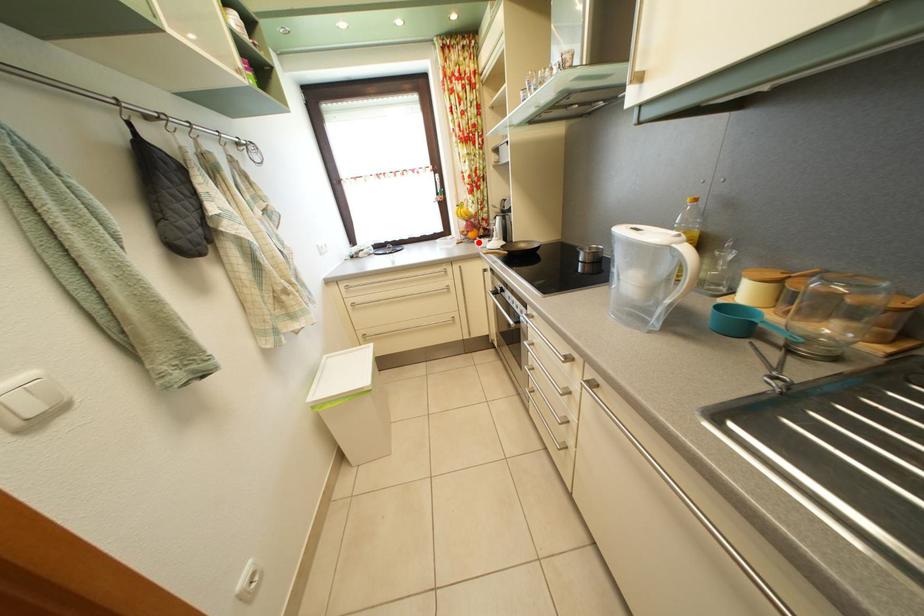
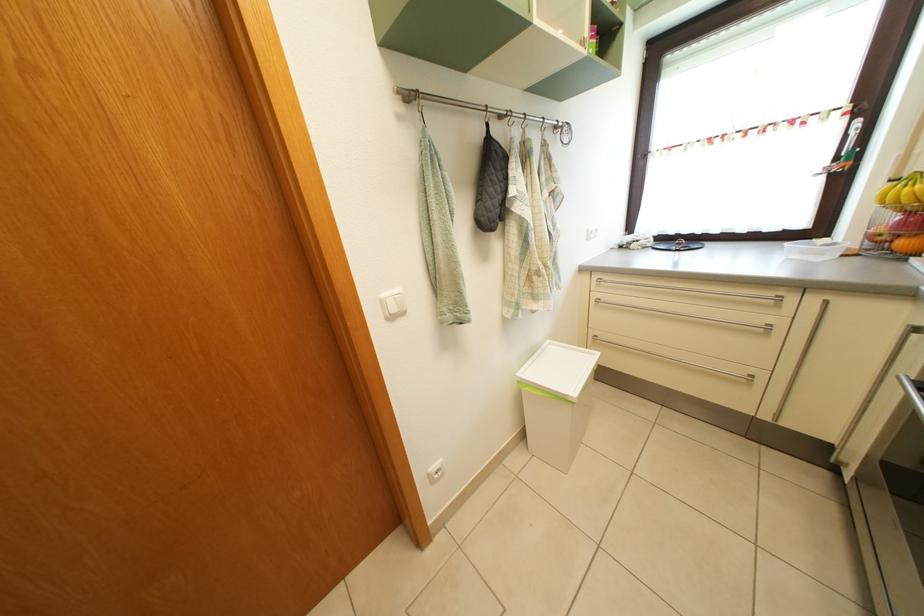
Question: I am providing you with two images of the same scene from different viewpoints. A red point is marked on the first image. Is the red point's position out of view in image 2?

Choices:
 (A) Yes
 (B) No

Answer: (B)